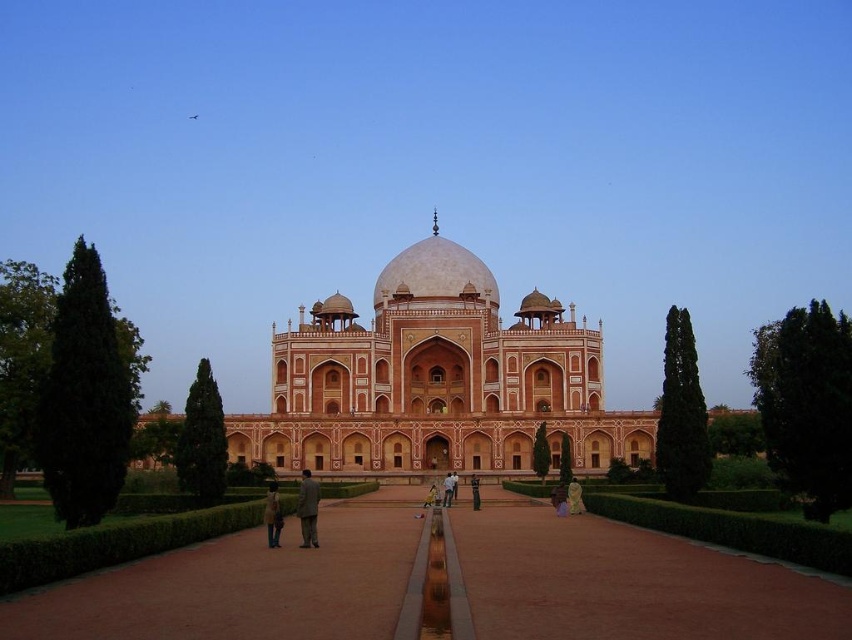
Which is more to the right, dark gray suit at center or light brown fabric coat at center?

From the viewer's perspective, dark gray suit at center appears more on the right side.

Find the location of `dark gray suit at center`. dark gray suit at center is located at coordinates (308, 508).

What do you see at coordinates (574, 497) in the screenshot? The image size is (852, 640). I see `light green fabric at center` at bounding box center [574, 497].

In the scene shown: Who is lower down, light green fabric at center or light brown fabric pants at center?

light brown fabric pants at center is lower down.

Measure the distance between point (579,506) and camera.

The distance of point (579,506) from camera is 79.74 meters.

Where is `light green fabric at center`? The height and width of the screenshot is (640, 852). light green fabric at center is located at coordinates (574, 497).

Which is behind, point (594, 444) or point (271, 538)?

Positioned behind is point (594, 444).

Consider the image. Is matte orange-red stone palace at center in front of light brown fabric coat at center?

No, it is not.

This screenshot has width=852, height=640. I want to click on matte orange-red stone palace at center, so click(436, 380).